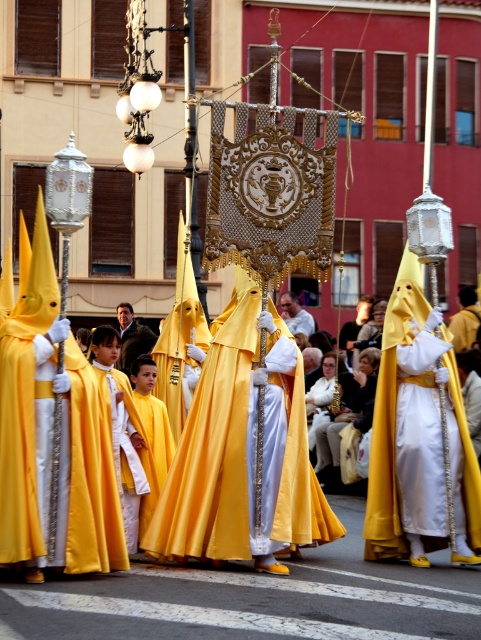
Question: Does satin yellow robe at center have a greater width compared to smooth brown coat at center?

Choices:
 (A) no
 (B) yes

Answer: (B)

Question: Which object is farther from the camera taking this photo?

Choices:
 (A) matte white robe at center
 (B) smooth brown coat at center

Answer: (A)

Question: Can you confirm if smooth brown coat at center is wider than matte white robe at center?

Choices:
 (A) yes
 (B) no

Answer: (A)

Question: Among these points, which one is nearest to the camera?

Choices:
 (A) (412, 356)
 (B) (14, 541)
 (C) (303, 332)

Answer: (B)

Question: Which object is farther from the camera taking this photo?

Choices:
 (A) smooth brown coat at center
 (B) matte gold robe at center

Answer: (A)

Question: Is the position of matte gold robe at center less distant than that of smooth brown coat at center?

Choices:
 (A) yes
 (B) no

Answer: (A)